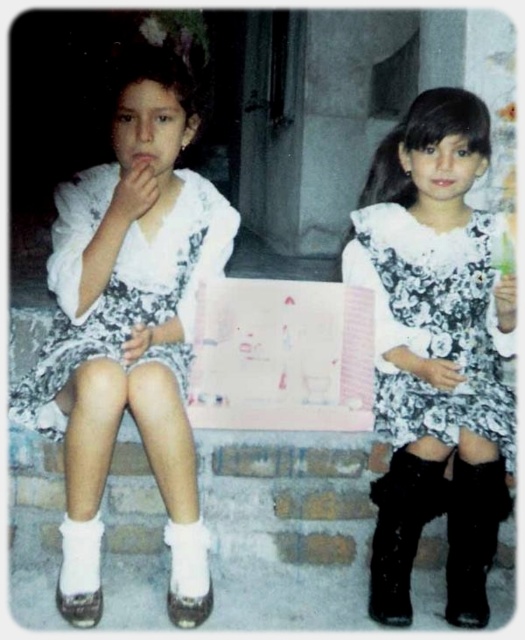
You are a photographer trying to capture a closeup of the white lace dress at left and the black leather boot at lower right. Which object should you focus on first to ensure it appears sharp in the photo?

The white lace dress at left is closer to the viewer than the black leather boot at lower right, so you should focus on the white lace dress at left first to ensure it appears sharp in the photo.

You are standing in front of the image and notice two girls sitting against a stone wall. There is a point marked at coordinates (435, 353). Can you identify which girl is located at that point?

The point at (435, 353) corresponds to the floral dress at center, so the girl wearing the floral dress at center is located at that point.

You are standing in front of the two girls and want to know which of the two points, point (384, 252) or point (444, 500), is closer to you. Can you determine this based on their positions?

Point (384, 252) is further to the viewer than point (444, 500), so the closer point to you is point (444, 500).